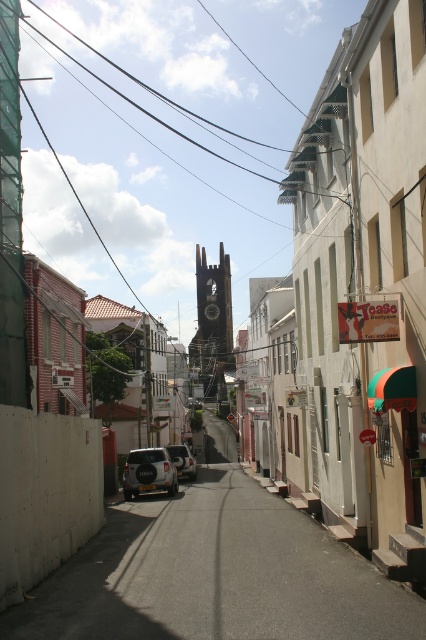
Question: Which point is farther to the camera?

Choices:
 (A) smooth asphalt road at center
 (B) dark gray stone spire at center
 (C) white matte car at center
 (D) white matte suv at center

Answer: (B)

Question: Which object is farther from the camera taking this photo?

Choices:
 (A) dark gray stone spire at center
 (B) white matte car at center

Answer: (A)

Question: Where is dark gray stone spire at center located in relation to white matte car at center in the image?

Choices:
 (A) below
 (B) above

Answer: (B)

Question: Does white matte suv at center have a lesser width compared to white matte car at center?

Choices:
 (A) no
 (B) yes

Answer: (A)

Question: In this image, where is smooth asphalt road at center located relative to dark gray stone spire at center?

Choices:
 (A) left
 (B) right

Answer: (B)

Question: Which of the following is the farthest from the observer?

Choices:
 (A) (170, 449)
 (B) (221, 321)
 (C) (124, 532)

Answer: (B)